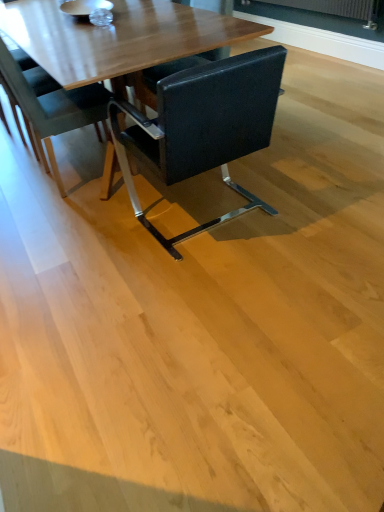
The image size is (384, 512). In order to click on free location in front of black leather chair at center, the 1th chair viewed from the left in this screenshot , I will do `click(70, 222)`.